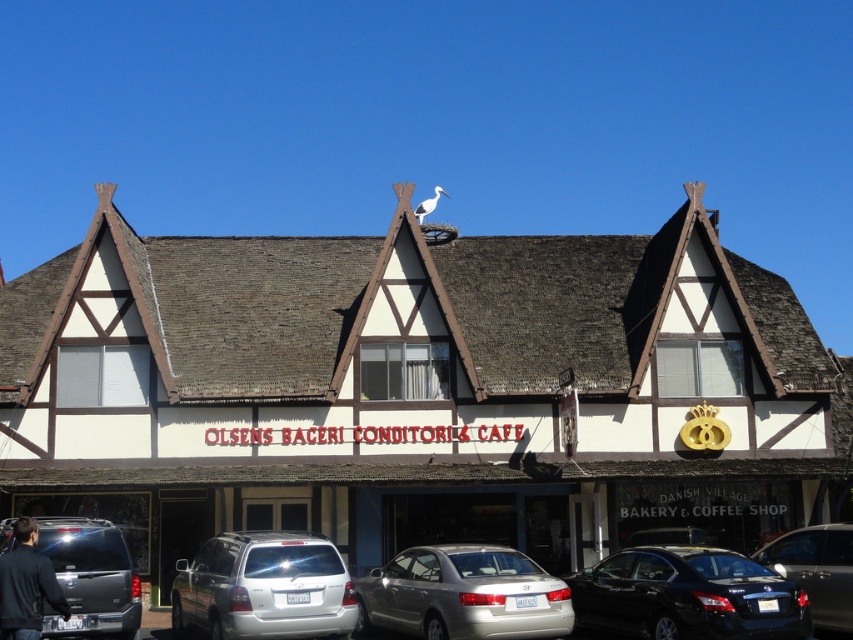
You are a customer arriving at Olsens Bageri Conditori Cafe and need to park your car. You have a compact car that is 1.8 meters wide. There are two parking spots available next to the building. One is near the lower right where the shiny black sedan at lower right was parked, and the other is at lower center where the metallic silver sedan at lower center was parked. Which parking spot can your car fit into?

The shiny black sedan at lower right is thinner than the metallic silver sedan at lower center. Since your car is 1.8 meters wide, the parking spot at lower right where the shiny black sedan was parked is narrower and may not accommodate your car. The metallic silver sedan at lower center, being wider, indicates its parking spot is wider and can fit your car.

You are a customer arriving at Olsens Bageri Conditori and want to park your car. You see a metallic gray suv at lower left and a metallic silver car at lower center. Which parking spot is more spacious for a larger vehicle?

The metallic silver car at lower center is parked in a more spacious spot since the metallic gray suv at lower left occupies less space than the metallic silver car at lower center.

You are a delivery driver who needs to park your truck, which is 1.8 meters tall, near the building. You see the metallic silver sedan at lower center and the metallic gray suv at lower left parked nearby. Can your truck fit in the parking spot between them without hitting the roof?

The metallic silver sedan at lower center is taller than the metallic gray suv at lower left. Since the truck is 1.8 meters tall, and the tallest vehicle between them is the metallic silver sedan at lower center, you need to compare the truck height with the sedan. However, the exact height of the sedan isn not provided, so it is uncertain if the truck can fit without hitting the roof.